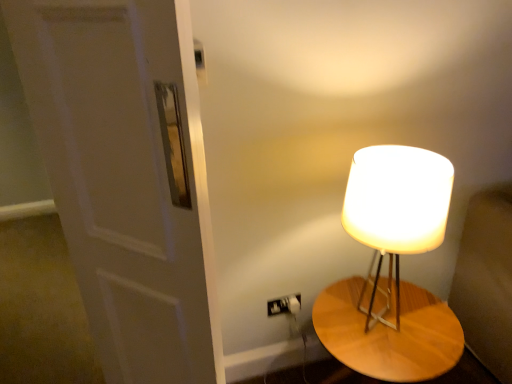
Question: Can wooden table at right be found inside matte white lampshade at right?

Choices:
 (A) yes
 (B) no

Answer: (B)

Question: Considering the relative sizes of matte white lampshade at right and wooden table at right in the image provided, is matte white lampshade at right taller than wooden table at right?

Choices:
 (A) yes
 (B) no

Answer: (A)

Question: Is matte white lampshade at right wider than wooden table at right?

Choices:
 (A) yes
 (B) no

Answer: (B)

Question: Is the depth of matte white lampshade at right greater than that of wooden table at right?

Choices:
 (A) yes
 (B) no

Answer: (B)

Question: From the image's perspective, would you say matte white lampshade at right is positioned over wooden table at right?

Choices:
 (A) yes
 (B) no

Answer: (A)

Question: Is white matte door at left to the left or to the right of matte white lampshade at right in the image?

Choices:
 (A) right
 (B) left

Answer: (B)

Question: From their relative heights in the image, would you say white matte door at left is taller or shorter than matte white lampshade at right?

Choices:
 (A) tall
 (B) short

Answer: (A)

Question: Does point (120, 329) appear closer or farther from the camera than point (404, 223)?

Choices:
 (A) farther
 (B) closer

Answer: (A)

Question: From the image's perspective, is white matte door at left located above or below matte white lampshade at right?

Choices:
 (A) above
 (B) below

Answer: (B)

Question: In terms of width, does wooden table at right look wider or thinner when compared to matte white lampshade at right?

Choices:
 (A) wide
 (B) thin

Answer: (A)

Question: In terms of height, does wooden table at right look taller or shorter compared to matte white lampshade at right?

Choices:
 (A) tall
 (B) short

Answer: (B)

Question: From a real-world perspective, is wooden table at right positioned above or below matte white lampshade at right?

Choices:
 (A) above
 (B) below

Answer: (B)

Question: Is wooden table at right in front of or behind matte white lampshade at right in the image?

Choices:
 (A) front
 (B) behind

Answer: (B)

Question: In the image, is white matte door at left positioned in front of or behind wooden table at right?

Choices:
 (A) behind
 (B) front

Answer: (B)

Question: Based on their sizes in the image, would you say white matte door at left is bigger or smaller than wooden table at right?

Choices:
 (A) big
 (B) small

Answer: (B)